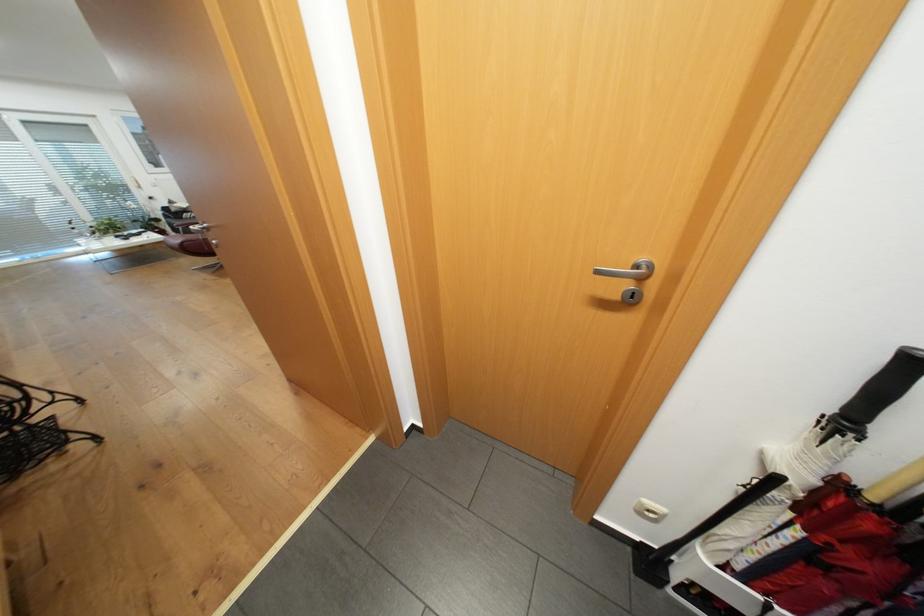
Find where to insert the door keyhole. Please return your answer as a coordinate pair (x, y).

(631, 294)